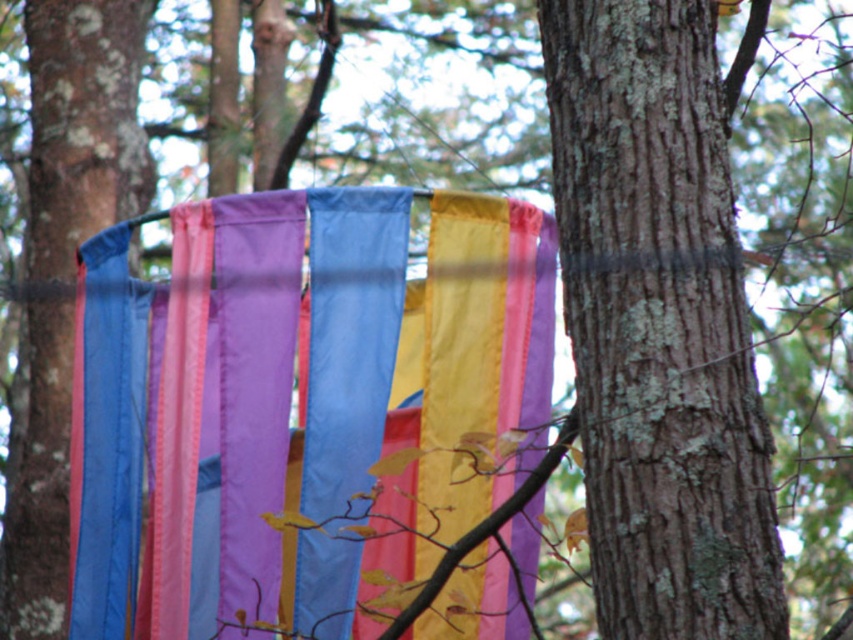
Question: Does smooth bark tree trunk at center have a greater width compared to smooth bark tree trunk at left?

Choices:
 (A) no
 (B) yes

Answer: (A)

Question: Which of the following is the closest to the observer?

Choices:
 (A) (630, 96)
 (B) (64, 452)
 (C) (263, 195)

Answer: (A)

Question: Which of these objects is positioned farthest from the smooth bark tree trunk at center?

Choices:
 (A) silky fabric strips at center
 (B) smooth bark tree trunk at left

Answer: (B)

Question: Is smooth bark tree trunk at center bigger than smooth bark tree trunk at left?

Choices:
 (A) yes
 (B) no

Answer: (B)

Question: Which point is farther to the camera?

Choices:
 (A) smooth bark tree trunk at center
 (B) silky fabric strips at center

Answer: (B)

Question: Can you confirm if silky fabric strips at center is positioned to the right of smooth bark tree trunk at left?

Choices:
 (A) yes
 (B) no

Answer: (A)